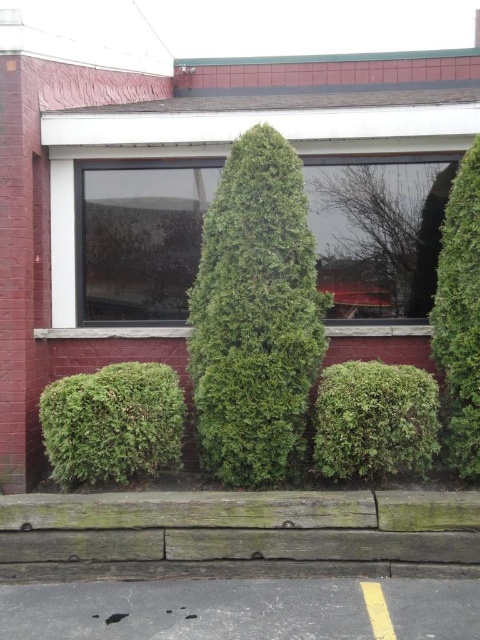
You are standing in front of the building and see the green textured bush at lower left and the green leafy shrub at right. Which one is closer to you?

The green textured bush at lower left is closer to you because it is in front of the green leafy shrub at right.

You are a gardener who needs to trim the green textured bush at lower left and the green leafy shrub at right. Based on their heights, which one requires a ladder to reach the top?

The green leafy shrub at right requires a ladder to reach the top because it is taller than the green textured bush at lower left.

You are standing in front of the building and want to place a small potted plant between the weathered wood curb at lower center and the green leafy shrub at center. Based on their positions, where should you place the potted plant?

The weathered wood curb at lower center is below the green leafy shrub at center, so you should place the potted plant between them along the vertical axis, positioning it above the weathered wood curb at lower center and below the green leafy shrub at center.